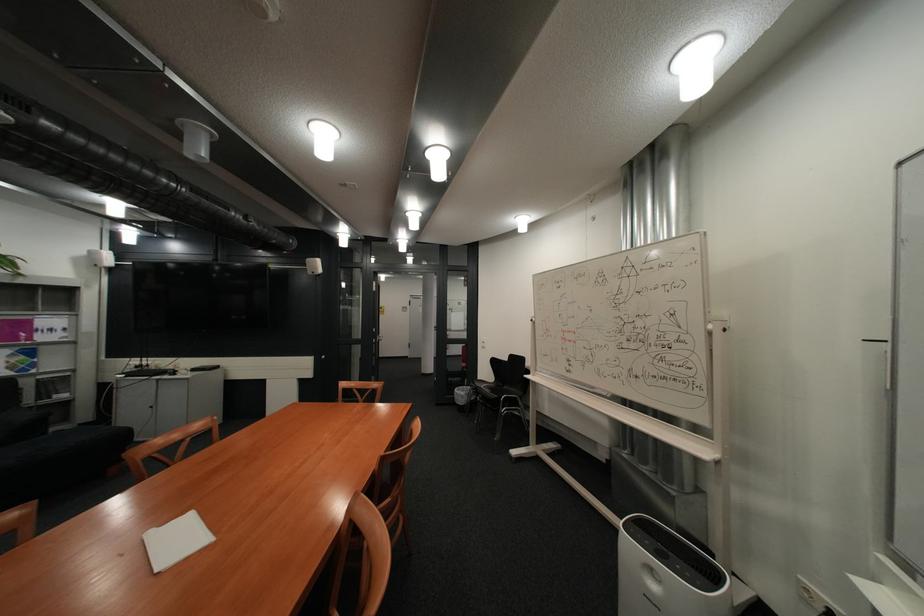
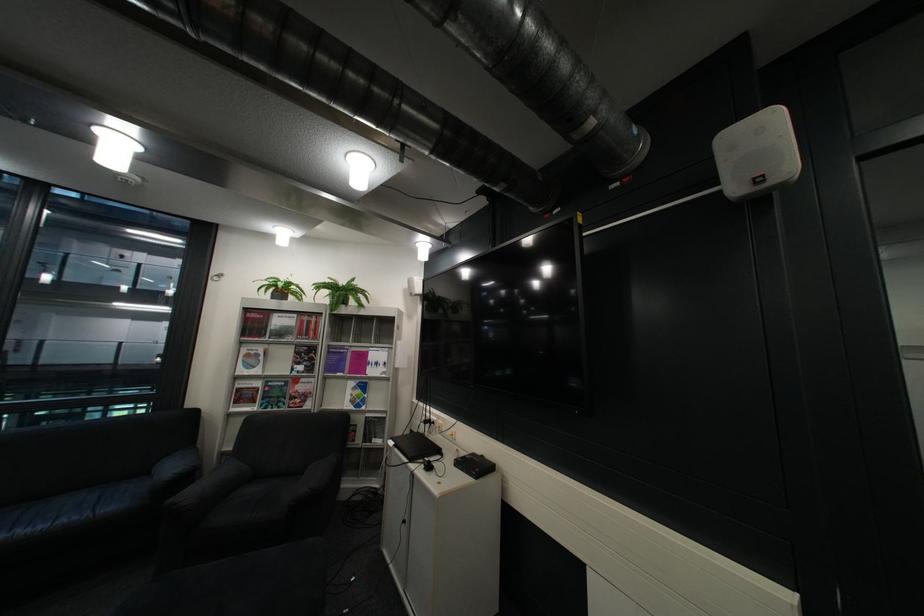
Where in the second image is the point corresponding to (x=78, y=395) from the first image?

(393, 442)